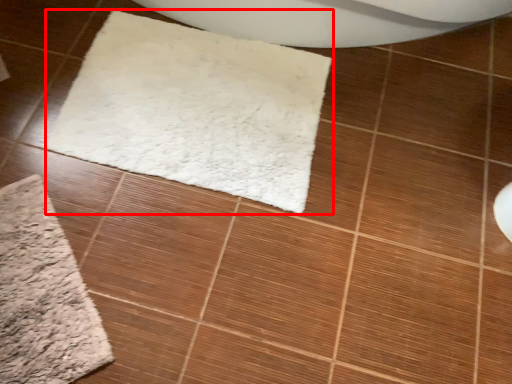
Question: Considering the relative positions of mat (annotated by the red box) and bath mat in the image provided, where is mat (annotated by the red box) located with respect to the staircase?

Choices:
 (A) left
 (B) right

Answer: (B)